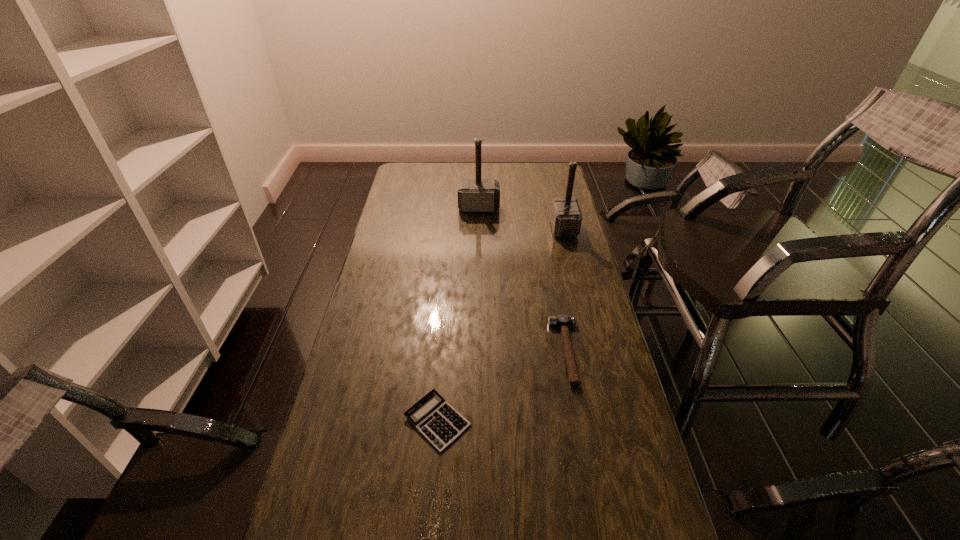
Identify the location of free space between the nearest object and the third farthest object. The image size is (960, 540). (502, 386).

Where is `free spot between the second farthest hammer and the farthest hammer`? The image size is (960, 540). free spot between the second farthest hammer and the farthest hammer is located at coordinates (521, 218).

This screenshot has width=960, height=540. Identify the location of vacant space that is in between the shortest object and the farthest object. (458, 314).

I want to click on free area in between the second farthest object and the leftmost hammer, so click(521, 218).

You are a GUI agent. You are given a task and a screenshot of the screen. Output one action in this format:
    pyautogui.click(x=<x>, y=<y>)
    Task: Click on the free space between the shortest hammer and the second farthest object
    
    Given the screenshot: What is the action you would take?
    pyautogui.click(x=565, y=290)

In order to click on free space that is in between the shortest object and the shortest hammer in this screenshot , I will do `click(502, 386)`.

This screenshot has width=960, height=540. In order to click on free space between the second farthest object and the nearest hammer in this screenshot , I will do `click(565, 290)`.

Point out which object is positioned as the second nearest to the third nearest object. Please provide its 2D coordinates. Your answer should be formatted as a tuple, i.e. [(x, y)], where the tuple contains the x and y coordinates of a point satisfying the conditions above.

[(563, 321)]

Identify which object is located as the nearest to the second nearest object. Please provide its 2D coordinates. Your answer should be formatted as a tuple, i.e. [(x, y)], where the tuple contains the x and y coordinates of a point satisfying the conditions above.

[(440, 424)]

Identify which hammer is the closest to the second farthest hammer. Please provide its 2D coordinates. Your answer should be formatted as a tuple, i.e. [(x, y)], where the tuple contains the x and y coordinates of a point satisfying the conditions above.

[(474, 195)]